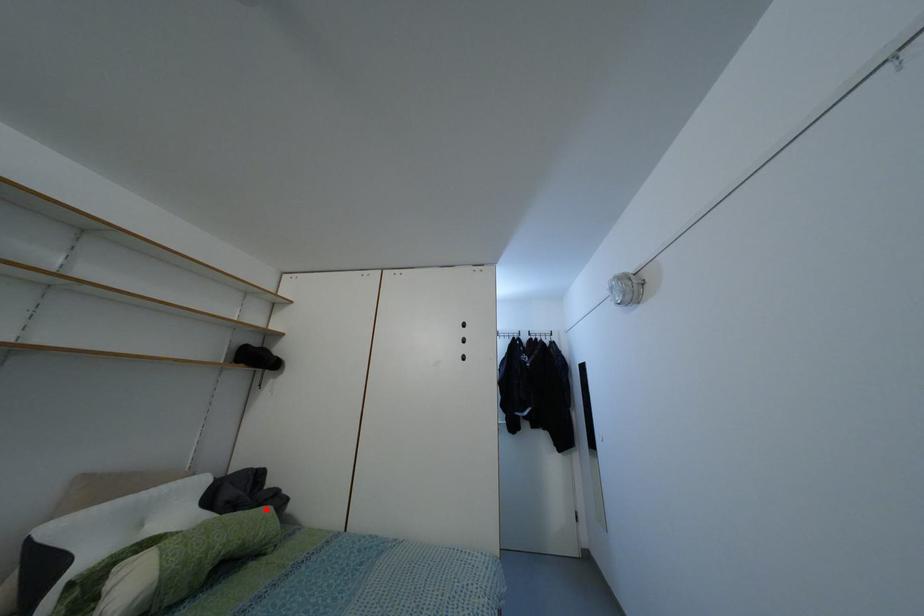
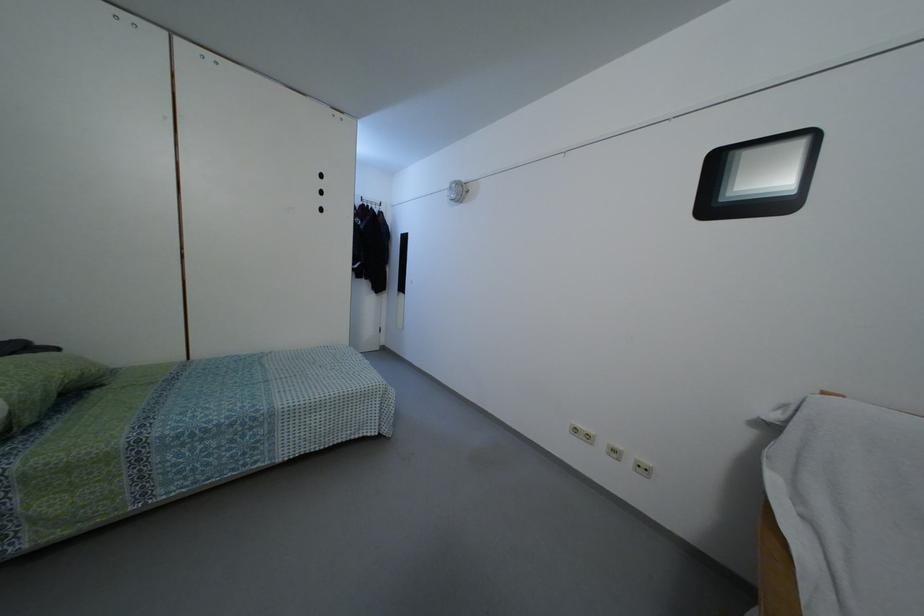
Locate, in the second image, the point that corresponds to the highlighted location in the first image.

(52, 354)